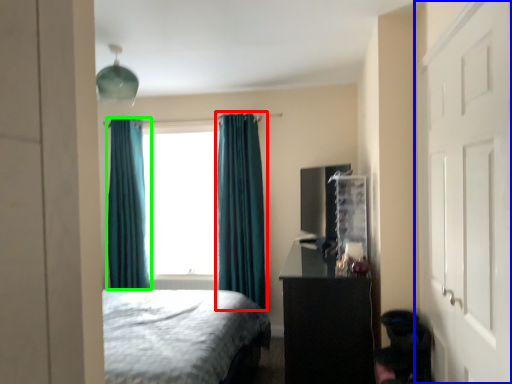
Question: Estimate the real-world distances between objects in this image. Which object is farther from curtain (highlighted by a red box), door (highlighted by a blue box) or curtain (highlighted by a green box)?

Choices:
 (A) door
 (B) curtain

Answer: (A)